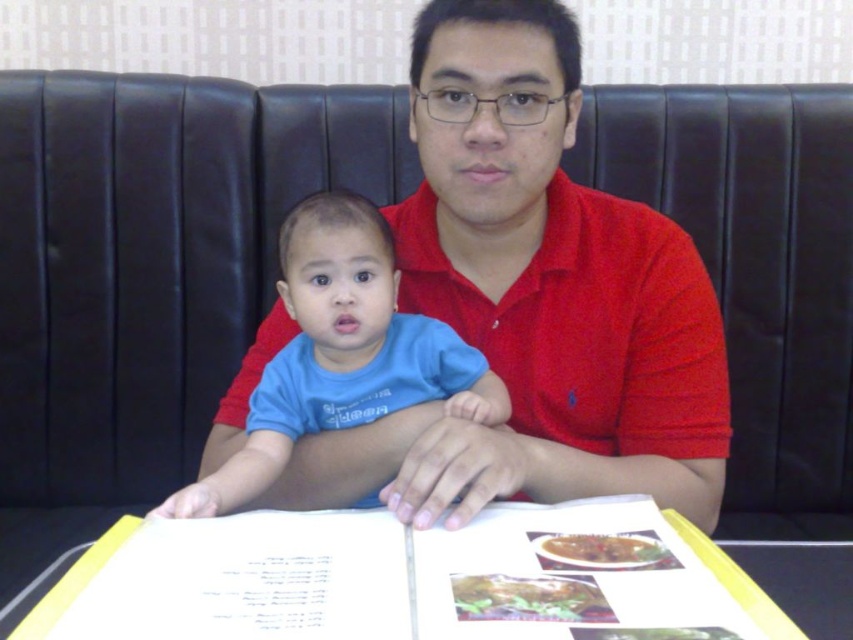
You are a photographer trying to capture a candid shot of the baby in the light blue t shirt. To do this, you need to position your camera so that the baby is centered in the frame. Given that the baby is currently at point (x=341, y=353), what adjustment should you make to the camera position to center the baby?

The blue cotton shirt at center is located at point (x=341, y=353). To center the baby in the frame, the camera should be adjusted so that the baby is positioned at the center coordinates of the image, which would require moving the camera or adjusting the frame so that the point (x=341, y=353) aligns with the center of the image.